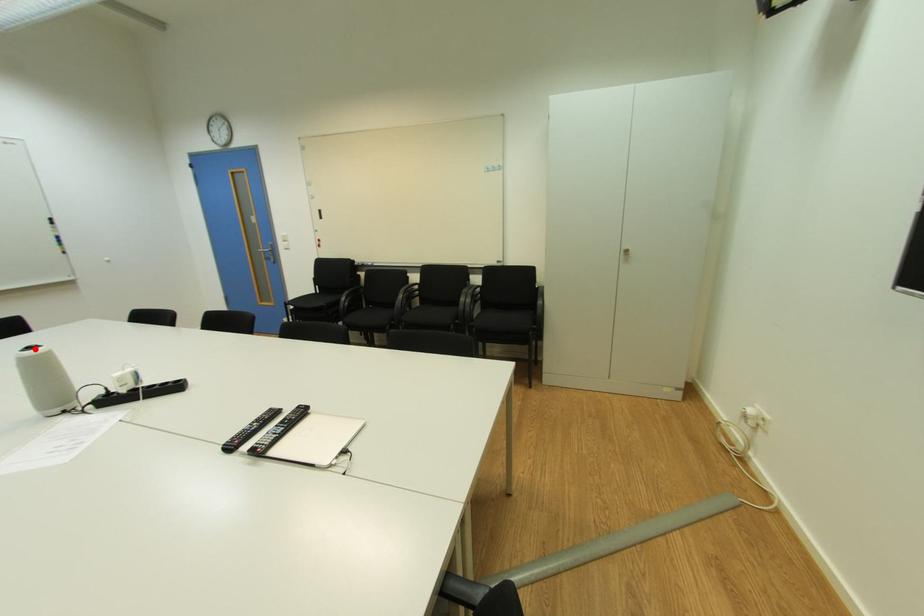
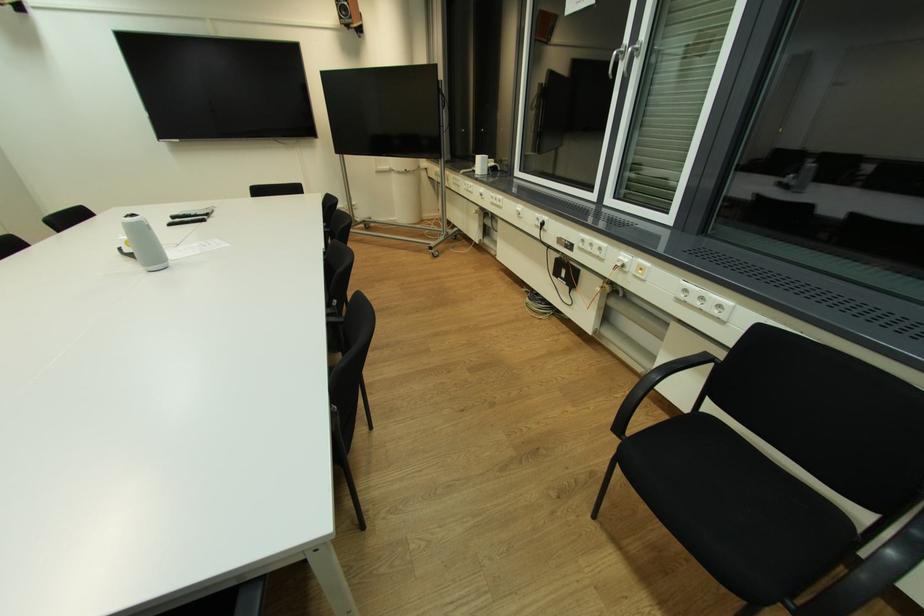
Find the pixel in the second image that matches the highlighted location in the first image.

(137, 216)